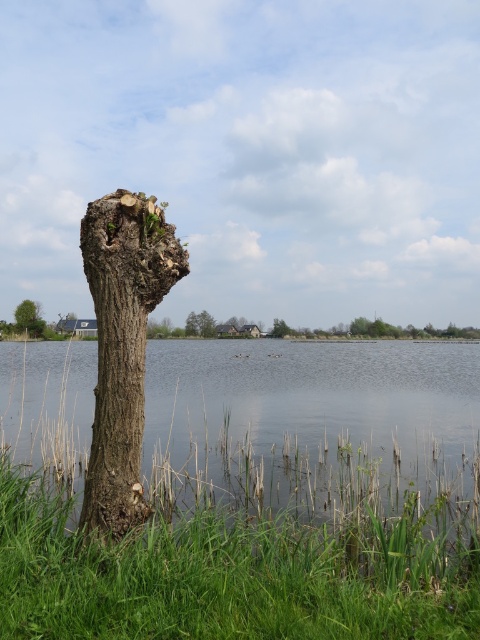
You are standing at the edge of the lake and want to walk towards the smooth bark tree trunk at center. Which direction should you walk to avoid stepping on the green grass at lower left?

To avoid stepping on the green grass at lower left, you should walk to the right side of the smooth bark tree trunk at center since the green grass at lower left is located to its left.

Looking at this image, you are standing at the lakeside and want to walk from the green rough bark tree at left to the clear water at center. Which direction should you move?

You should move to the right to reach the clear water at center from the green rough bark tree at left since the clear water at center is located to the right of the green rough bark tree at left.

You are a park ranger assessing the health of trees in the area. You notice two trees on the left side of the image, a rough bark tree trunk at left and a green rough bark tree at left. Which tree has a wider trunk?

The green rough bark tree at left has a wider trunk than the rough bark tree trunk at left.